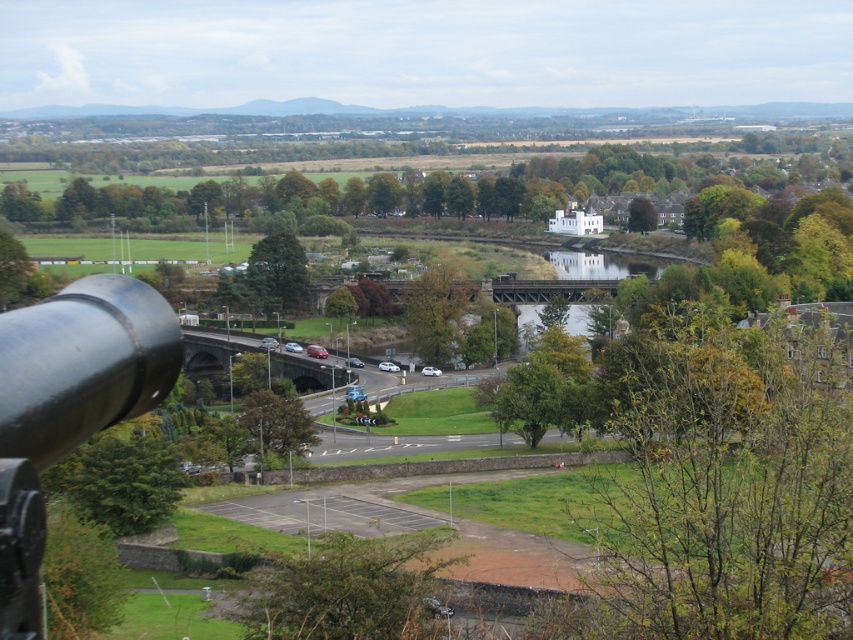
You are standing at the elevated vantage point and want to determine the order of two points in the scene. Which point is closer to you, the point at coordinates point (279, 236) or point (299, 410)?

Point (299, 410) is closer to you because the description states that point (279, 236) is behind point (299, 410).